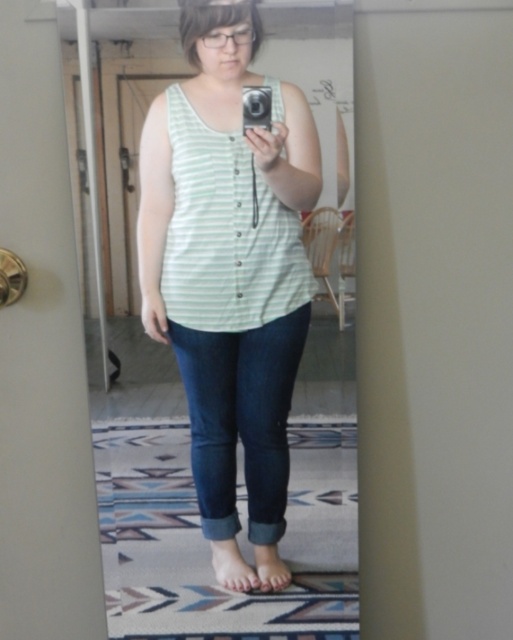
Which is above, light green striped tank top at center or green striped tank top at center?

green striped tank top at center is above.

Is the position of light green striped tank top at center more distant than that of green striped tank top at center?

That is False.

This screenshot has width=513, height=640. Find the location of `light green striped tank top at center`. light green striped tank top at center is located at coordinates (229, 273).

Who is taller, green striped tank top at center or dark blue denim jeans at lower center?

dark blue denim jeans at lower center

Is green striped tank top at center to the right of dark blue denim jeans at lower center from the viewer's perspective?

Correct, you'll find green striped tank top at center to the right of dark blue denim jeans at lower center.

Locate an element on the screen. This screenshot has width=513, height=640. green striped tank top at center is located at coordinates (226, 232).

Which of these two, light green striped tank top at center or dark blue denim jeans at lower center, stands taller?

With more height is light green striped tank top at center.

Which is below, light green striped tank top at center or dark blue denim jeans at lower center?

Positioned lower is dark blue denim jeans at lower center.

Who is more forward, (244, 369) or (267, 394)?

Point (244, 369) is in front.

Find the location of a particular element. light green striped tank top at center is located at coordinates (229, 273).